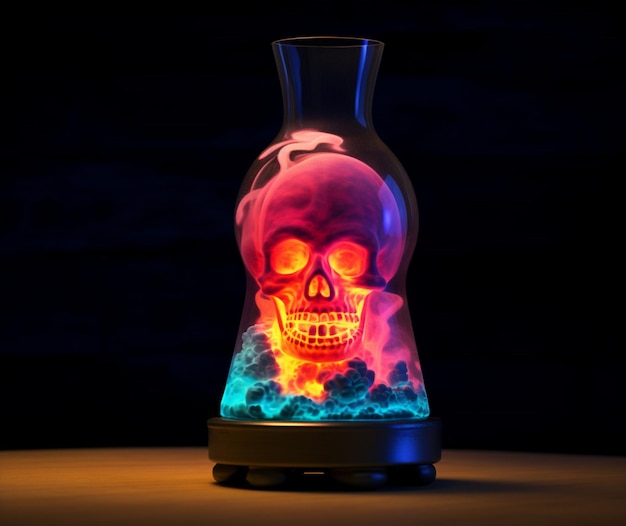
You are a GUI agent. You are given a task and a screenshot of the screen. Output one action in this format:
    pyautogui.click(x=<x>, y=<y>)
    Task: Click on the glass jar
    The width and height of the screenshot is (626, 526).
    Given the screenshot: What is the action you would take?
    pyautogui.click(x=326, y=87)